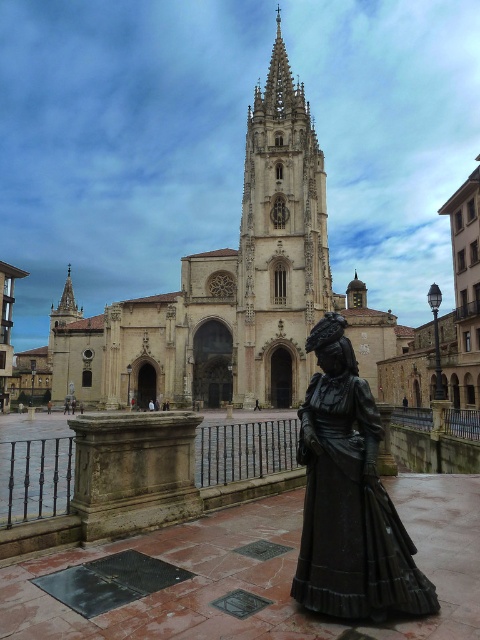
Question: Can you confirm if smooth stone tower at center is positioned to the right of bronze statue at lower right?

Choices:
 (A) no
 (B) yes

Answer: (B)

Question: Which of the following is the closest to the observer?

Choices:
 (A) (319, 173)
 (B) (384, 564)

Answer: (B)

Question: Which point appears farthest from the camera in this image?

Choices:
 (A) (295, 353)
 (B) (310, 568)

Answer: (A)

Question: Can you confirm if smooth stone tower at center is positioned to the left of bronze statue at lower right?

Choices:
 (A) yes
 (B) no

Answer: (B)

Question: Is smooth stone tower at center smaller than bronze statue at lower right?

Choices:
 (A) yes
 (B) no

Answer: (B)

Question: Which point is farther from the camera taking this photo?

Choices:
 (A) (304, 397)
 (B) (264, 160)

Answer: (B)